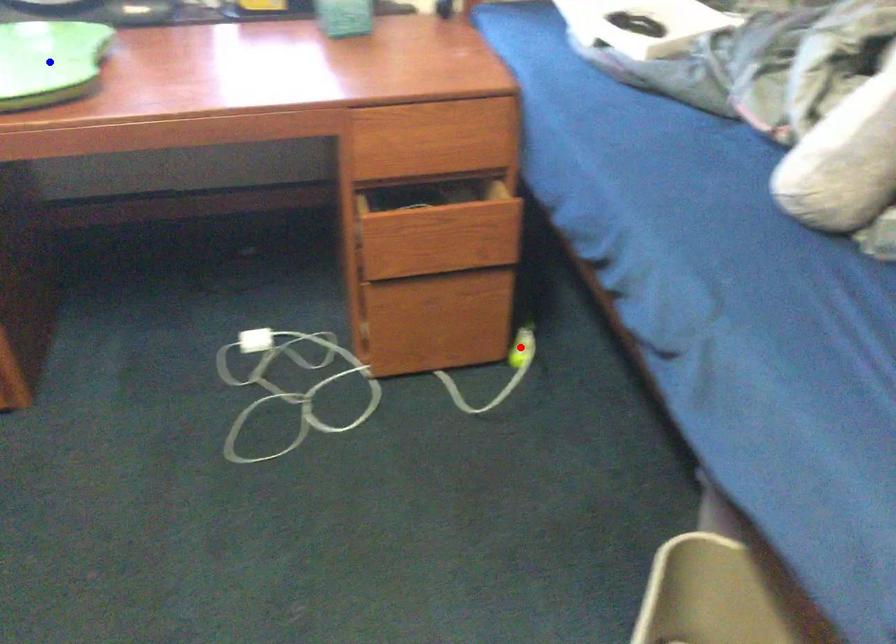
Question: Which of the two points in the image is closer to the camera?

Choices:
 (A) Blue point is closer.
 (B) Red point is closer.

Answer: (A)